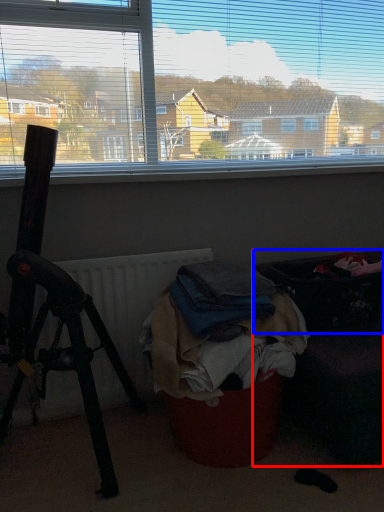
Question: Which point is further to the camera, furniture (highlighted by a red box) or laundry basket (highlighted by a blue box)?

Choices:
 (A) furniture
 (B) laundry basket

Answer: (B)